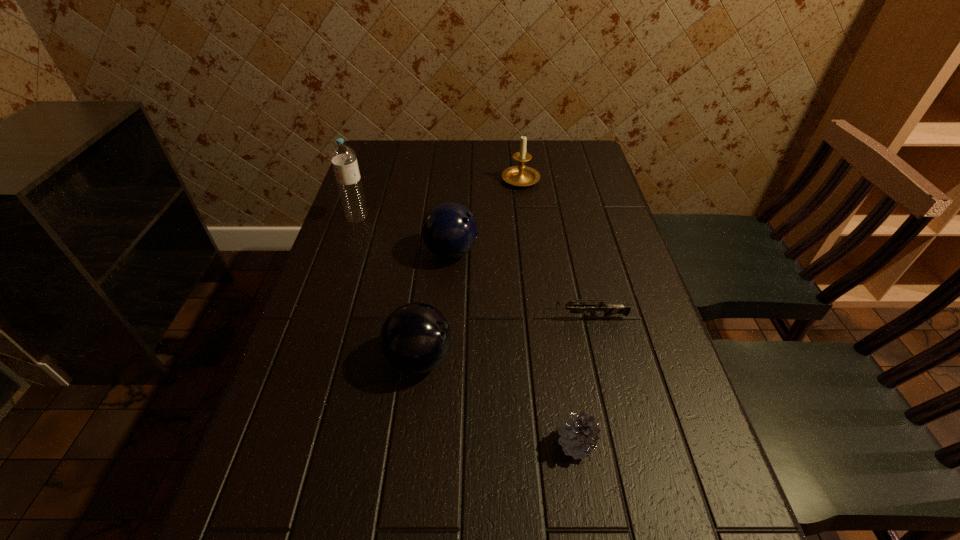
At what (x,y) coordinates should I click in order to perform the action: click on vacant space situated 0.060m with a handle on the side of the candle holder. Please return your answer as a coordinate pair (x, y). This screenshot has width=960, height=540. Looking at the image, I should click on (517, 157).

This screenshot has width=960, height=540. Identify the location of free region located with a handle on the side of the candle holder. (516, 145).

At what (x,y) coordinates should I click in order to perform the action: click on free space located 0.090m with a handle on the side of the candle holder. Please return your answer as a coordinate pair (x, y). Looking at the image, I should click on (517, 153).

Locate an element on the screen. free space located 0.250m on the surface of the farther bowling ball near the finger holes is located at coordinates (574, 252).

Identify the location of free space located on the side of the fifth farthest object with the finger holes. The image size is (960, 540). (570, 359).

Where is `free spot located on the right of the pinecone`? free spot located on the right of the pinecone is located at coordinates (670, 444).

Where is `vacant space located aimed along the barrel of the shortest object`? The height and width of the screenshot is (540, 960). vacant space located aimed along the barrel of the shortest object is located at coordinates (512, 318).

Where is `free region located aimed along the barrel of the shortest object`? The width and height of the screenshot is (960, 540). free region located aimed along the barrel of the shortest object is located at coordinates (x=431, y=318).

This screenshot has height=540, width=960. What are the coordinates of `vacant space located aimed along the barrel of the shortest object` in the screenshot? It's located at (449, 318).

The image size is (960, 540). In order to click on object located in the far edge section of the desktop in this screenshot , I will do `click(521, 175)`.